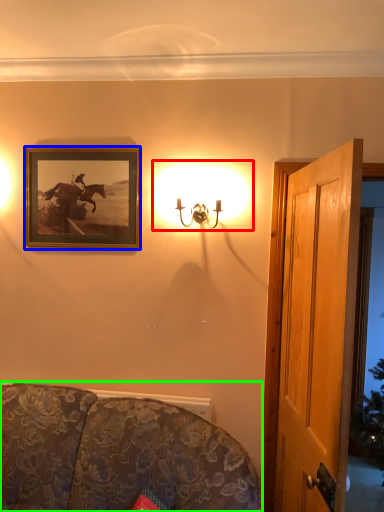
Question: Estimate the real-world distances between objects in this image. Which object is farther from lamp (highlighted by a red box), picture frame (highlighted by a blue box) or studio couch (highlighted by a green box)?

Choices:
 (A) picture frame
 (B) studio couch

Answer: (B)